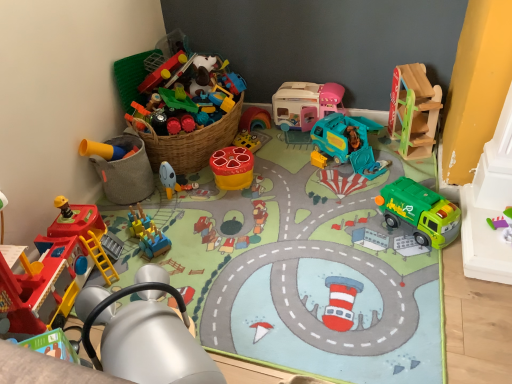
I want to click on vacant area that lies between green plastic garbage truck at lower right, which is the 8th toy in left-to-right order, and yellow matte bucket at lower left, the first toy in the left-to-right sequence, so click(280, 211).